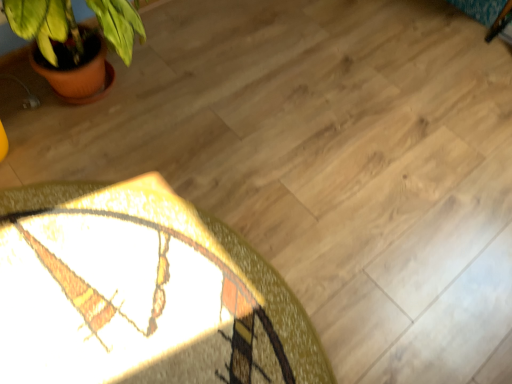
Where is `vacant area that lies to the right of shiny glass table at center`? The width and height of the screenshot is (512, 384). vacant area that lies to the right of shiny glass table at center is located at coordinates (393, 230).